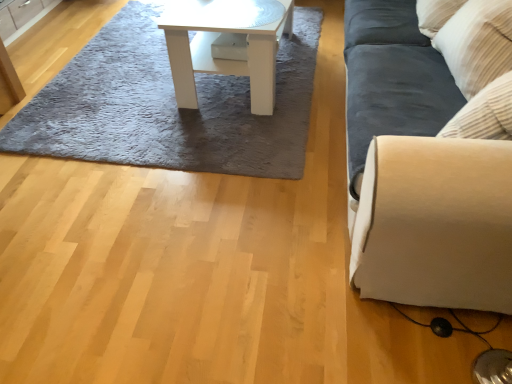
Question: Can you confirm if white glossy table at center is positioned to the right of matte wood cabinet at upper left?

Choices:
 (A) no
 (B) yes

Answer: (B)

Question: Is white glossy table at center shorter than matte wood cabinet at upper left?

Choices:
 (A) no
 (B) yes

Answer: (A)

Question: Is white glossy table at center not inside matte wood cabinet at upper left?

Choices:
 (A) no
 (B) yes

Answer: (B)

Question: From the image's perspective, would you say white glossy table at center is positioned over matte wood cabinet at upper left?

Choices:
 (A) yes
 (B) no

Answer: (B)

Question: Could matte wood cabinet at upper left be considered to be inside white glossy table at center?

Choices:
 (A) no
 (B) yes

Answer: (A)

Question: Is white glossy table at center oriented away from matte wood cabinet at upper left?

Choices:
 (A) yes
 (B) no

Answer: (B)

Question: Is white glossy table at center wider than gray shaggy rug at upper center?

Choices:
 (A) yes
 (B) no

Answer: (B)

Question: Is white glossy table at center positioned in front of gray shaggy rug at upper center?

Choices:
 (A) no
 (B) yes

Answer: (A)

Question: Does white glossy table at center turn towards gray shaggy rug at upper center?

Choices:
 (A) no
 (B) yes

Answer: (B)

Question: Does white glossy table at center have a smaller size compared to gray shaggy rug at upper center?

Choices:
 (A) no
 (B) yes

Answer: (A)

Question: Considering the relative sizes of white glossy table at center and gray shaggy rug at upper center in the image provided, is white glossy table at center bigger than gray shaggy rug at upper center?

Choices:
 (A) no
 (B) yes

Answer: (B)

Question: Is white glossy table at center to the left of gray shaggy rug at upper center from the viewer's perspective?

Choices:
 (A) no
 (B) yes

Answer: (A)

Question: From the image's perspective, does gray shaggy rug at upper center appear lower than suede-like beige couch at right?

Choices:
 (A) yes
 (B) no

Answer: (B)